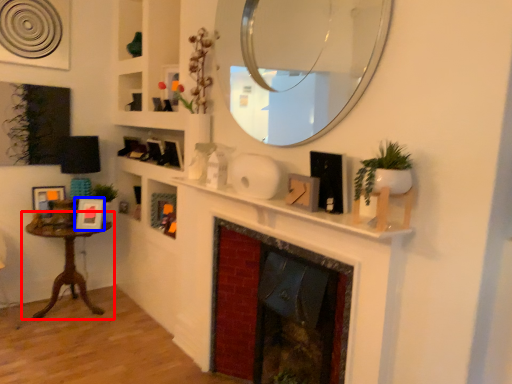
Question: Among these objects, which one is nearest to the camera, table (highlighted by a red box) or picture frame (highlighted by a blue box)?

Choices:
 (A) table
 (B) picture frame

Answer: (A)